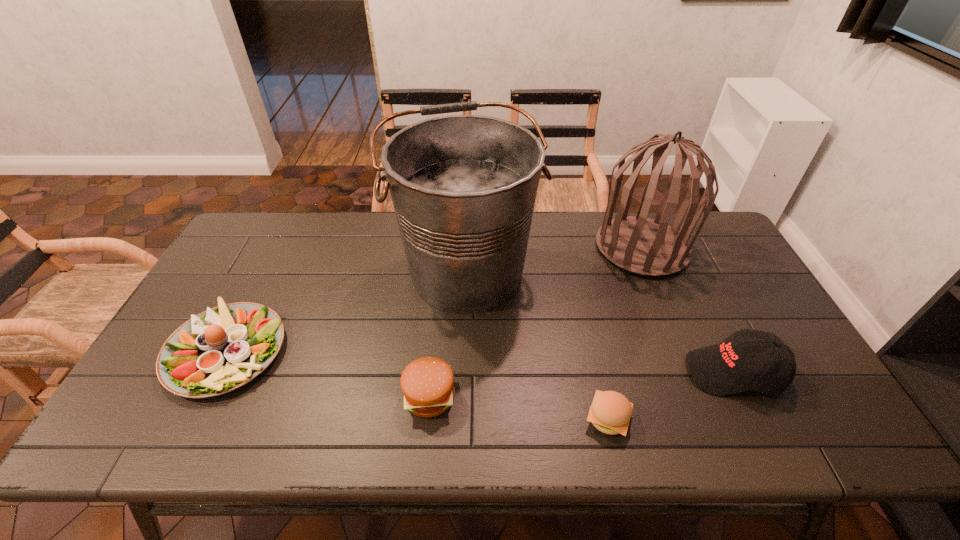
At what (x,y) coordinates should I click in order to perform the action: click on free space located on the front-facing side of the baseball cap. Please return your answer as a coordinate pair (x, y). The image size is (960, 540). Looking at the image, I should click on (547, 372).

Find the location of a particular element. The width and height of the screenshot is (960, 540). blank space located on the front-facing side of the baseball cap is located at coordinates (547, 372).

At what (x,y) coordinates should I click in order to perform the action: click on free space located 0.300m on the back of the salad plate. Please return your answer as a coordinate pair (x, y). Looking at the image, I should click on (283, 240).

Where is `free space located 0.370m on the left of the left hamburger`? The height and width of the screenshot is (540, 960). free space located 0.370m on the left of the left hamburger is located at coordinates (x=251, y=396).

You are a GUI agent. You are given a task and a screenshot of the screen. Output one action in this format:
    pyautogui.click(x=<x>, y=<y>)
    Task: Click on the blank space located 0.130m on the back of the shortest object
    Image resolution: width=960 pixels, height=540 pixels.
    Given the screenshot: What is the action you would take?
    pyautogui.click(x=593, y=353)

At what (x,y) coordinates should I click in order to perform the action: click on bucket situated at the far edge. Please return your answer as a coordinate pair (x, y). The image size is (960, 540). Looking at the image, I should click on (463, 187).

Where is `birdcage at the far edge`? This screenshot has height=540, width=960. birdcage at the far edge is located at coordinates (638, 244).

You are a GUI agent. You are given a task and a screenshot of the screen. Output one action in this format:
    pyautogui.click(x=<x>, y=<y>)
    Task: Click on the object that is at the left edge
    
    Given the screenshot: What is the action you would take?
    pyautogui.click(x=223, y=348)

Where is `birdcage that is at the right edge`? The width and height of the screenshot is (960, 540). birdcage that is at the right edge is located at coordinates (638, 244).

This screenshot has height=540, width=960. I want to click on baseball cap at the right edge, so point(726,368).